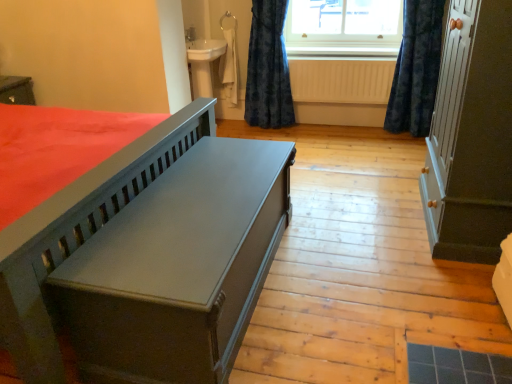
Question: From a real-world perspective, relative to dark blue velvet curtain at upper right, the 1th curtain in the right-to-left sequence, is matte gray bench at center vertically above or below?

Choices:
 (A) above
 (B) below

Answer: (B)

Question: Is point (89, 375) positioned closer to the camera than point (430, 54)?

Choices:
 (A) closer
 (B) farther

Answer: (A)

Question: Which object is positioned closest to the matte gray bench at center?

Choices:
 (A) dark blue velvet curtain at upper right, marked as the 2th curtain in a left-to-right arrangement
 (B) clear glass window at upper center
 (C) matte gray cabinet at right
 (D) velvet blue curtain at upper right, the 2th curtain from the right
 (E) white ribbed radiator at center

Answer: (C)

Question: Which of these objects is positioned farthest from the matte gray cabinet at right?

Choices:
 (A) dark blue velvet curtain at upper right, marked as the 2th curtain in a left-to-right arrangement
 (B) clear glass window at upper center
 (C) velvet blue curtain at upper right, the 1th curtain when ordered from left to right
 (D) white ribbed radiator at center
 (E) matte gray bench at center

Answer: (C)